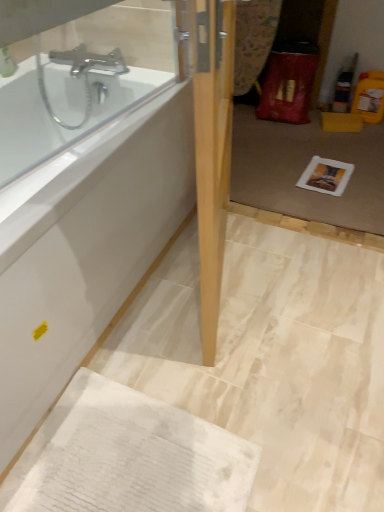
The height and width of the screenshot is (512, 384). Identify the location of vacant area that lies between transparent glass door at center and white textured towel at lower left. (257, 325).